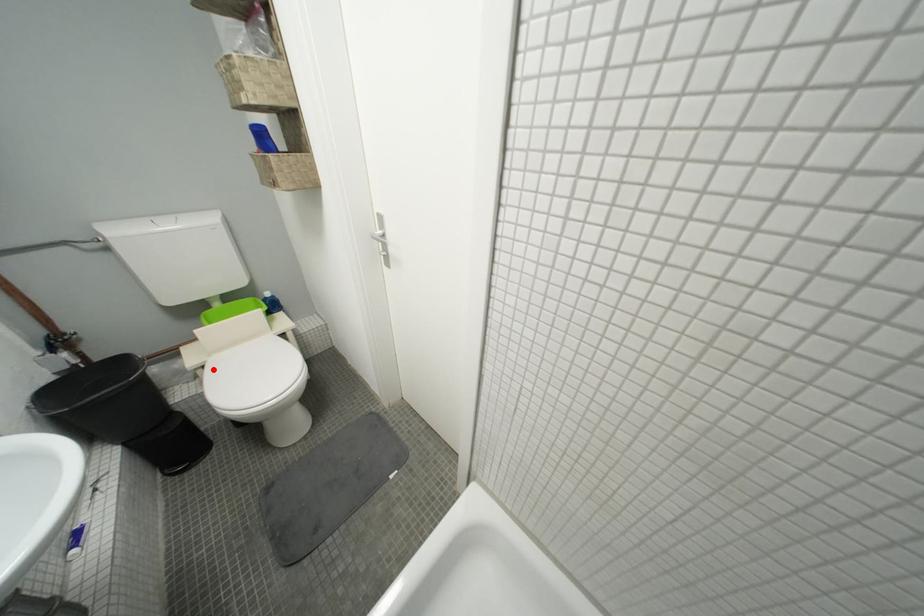
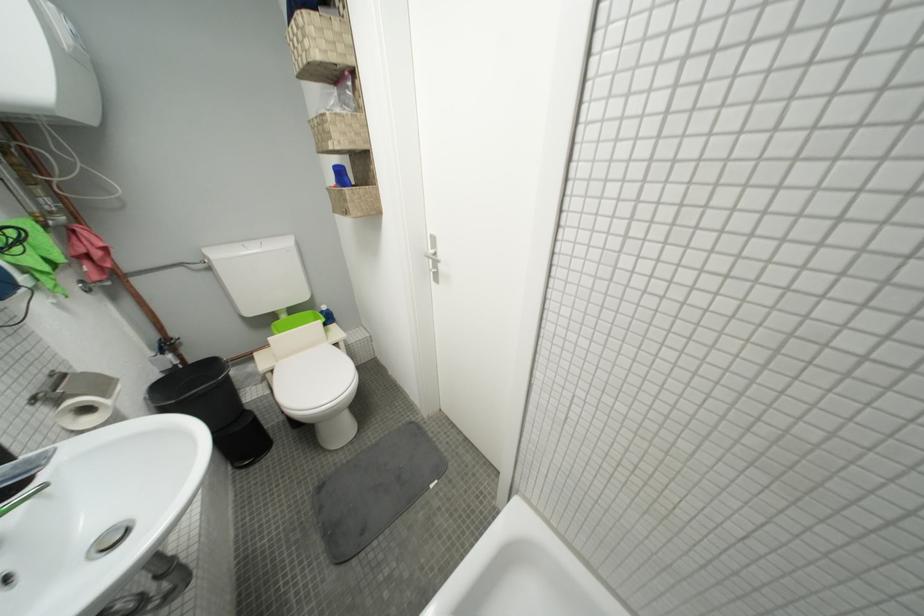
Question: I am providing you with two images of the same scene from different viewpoints. Image1 has a red point marked. In image2, the corresponding 3D location appears at what relative position? Reply with the corresponding letter.

Choices:
 (A) Closer
 (B) Farther

Answer: (B)